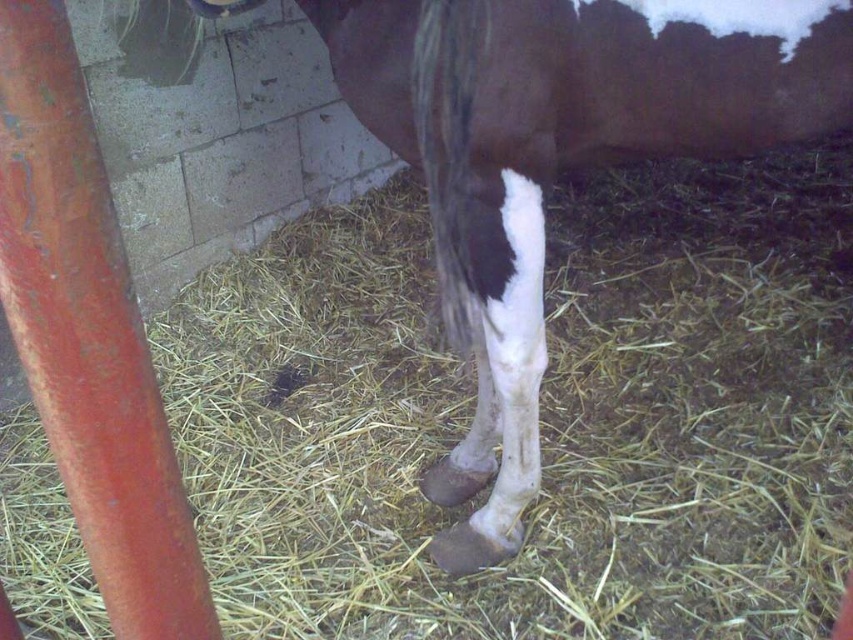
Question: Which object appears closest to the camera in this image?

Choices:
 (A) brown glossy tail at center
 (B) brown glossy horse leg at center

Answer: (B)

Question: Is brown glossy horse leg at center bigger than brown glossy tail at center?

Choices:
 (A) yes
 (B) no

Answer: (A)

Question: Can you confirm if brown glossy horse leg at center is bigger than brown glossy tail at center?

Choices:
 (A) yes
 (B) no

Answer: (A)

Question: Can you confirm if brown glossy horse leg at center is bigger than brown glossy tail at center?

Choices:
 (A) no
 (B) yes

Answer: (B)

Question: Which point is closer to the camera?

Choices:
 (A) brown glossy horse leg at center
 (B) brown glossy tail at center

Answer: (A)